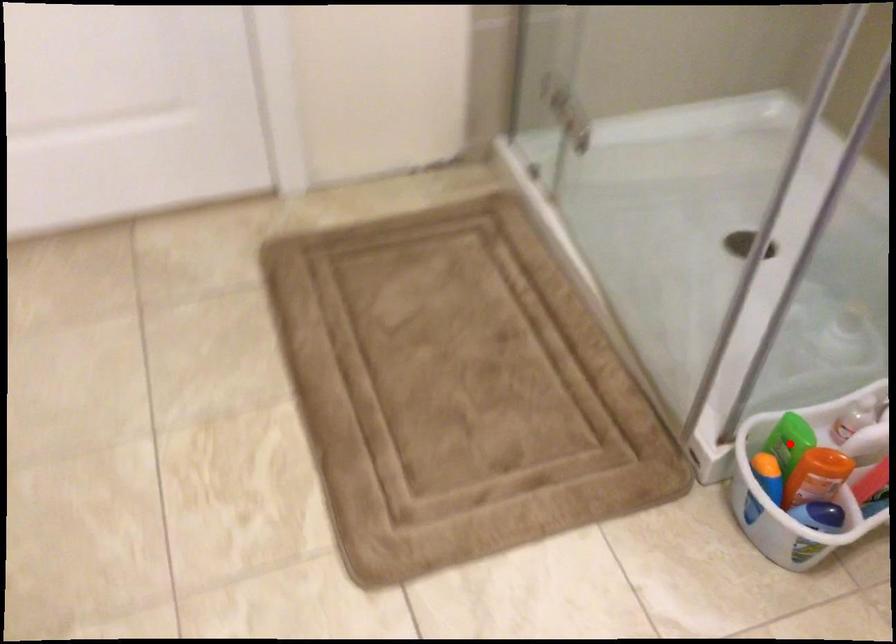
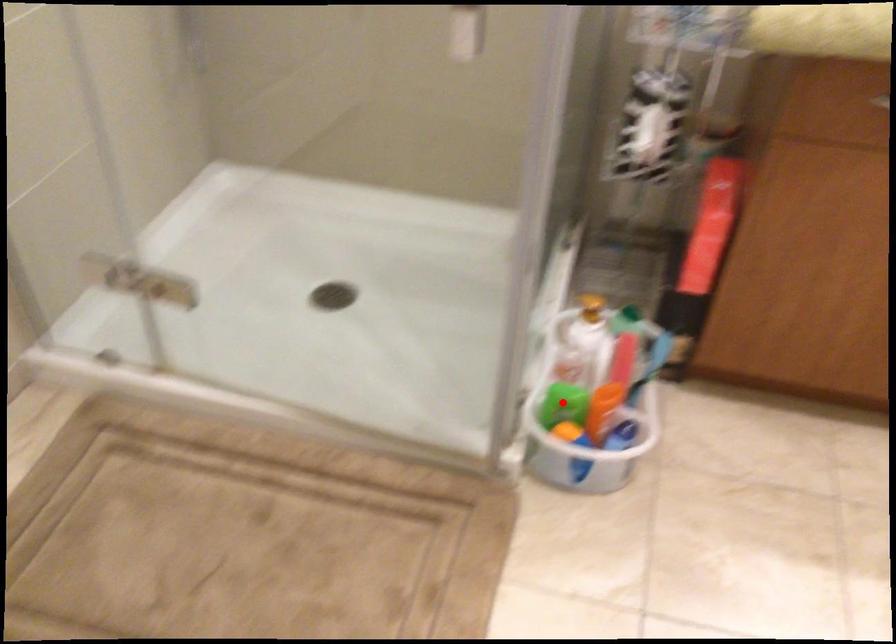
I am providing you with two images of the same scene from different viewpoints. A red point is marked on the first image and another point is marked on the second image. Is the marked point in image1 the same physical position as the marked point in image2?

Yes